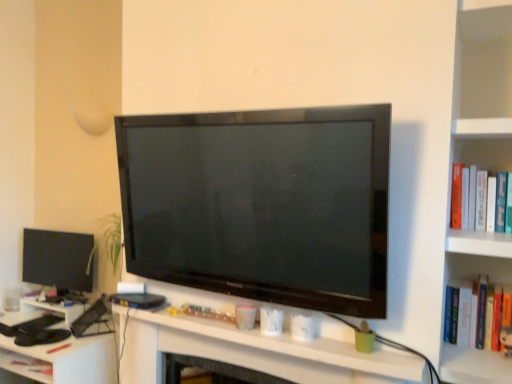
Question: Does matte black computer at center lie behind white plastic computer desk at lower left?

Choices:
 (A) yes
 (B) no

Answer: (B)

Question: Are matte black computer at center and white plastic computer desk at lower left making contact?

Choices:
 (A) yes
 (B) no

Answer: (B)

Question: Does matte black computer at center have a smaller size compared to white plastic computer desk at lower left?

Choices:
 (A) no
 (B) yes

Answer: (B)

Question: From a real-world perspective, does matte black computer at center sit lower than white plastic computer desk at lower left?

Choices:
 (A) no
 (B) yes

Answer: (A)

Question: Does matte black computer at center have a lesser width compared to white plastic computer desk at lower left?

Choices:
 (A) no
 (B) yes

Answer: (B)

Question: In terms of width, does matte black computer at center look wider or thinner when compared to white plastic computer desk at lower left?

Choices:
 (A) thin
 (B) wide

Answer: (A)

Question: Looking at the image, does matte black computer at center seem bigger or smaller compared to white plastic computer desk at lower left?

Choices:
 (A) big
 (B) small

Answer: (B)

Question: Is point pos(125,339) positioned closer to the camera than point pos(31,362)?

Choices:
 (A) closer
 (B) farther

Answer: (A)

Question: From a real-world perspective, is matte black computer at center above or below white plastic computer desk at lower left?

Choices:
 (A) below
 (B) above

Answer: (B)

Question: Is white plastic computer desk at lower left bigger or smaller than matte black computer at center?

Choices:
 (A) big
 (B) small

Answer: (A)

Question: Considering the relative positions of white plastic computer desk at lower left and matte black computer at center in the image provided, is white plastic computer desk at lower left to the left or to the right of matte black computer at center?

Choices:
 (A) right
 (B) left

Answer: (B)

Question: From a real-world perspective, is white plastic computer desk at lower left above or below matte black computer at center?

Choices:
 (A) below
 (B) above

Answer: (A)

Question: Is white plastic computer desk at lower left wider or thinner than matte black computer at center?

Choices:
 (A) thin
 (B) wide

Answer: (B)

Question: From the image's perspective, is matte black monitor at left located above or below hardcover book at right?

Choices:
 (A) below
 (B) above

Answer: (A)

Question: Based on their sizes in the image, would you say matte black monitor at left is bigger or smaller than hardcover book at right?

Choices:
 (A) big
 (B) small

Answer: (A)